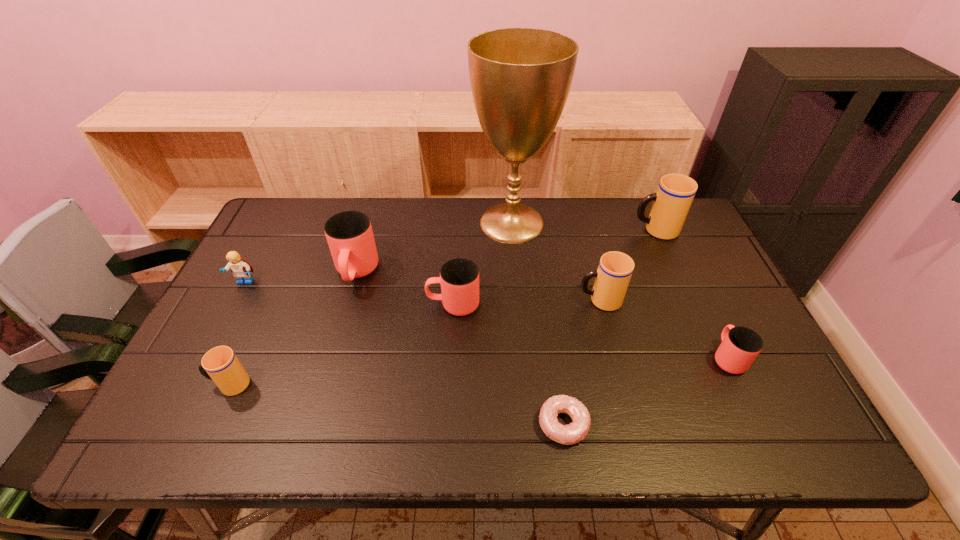
Identify the location of the leftmost cup. The height and width of the screenshot is (540, 960). (220, 364).

Identify the location of the nearest beige cup. (220, 364).

Where is `the smallest pink cup`? the smallest pink cup is located at coordinates (740, 346).

Locate an element on the screen. The width and height of the screenshot is (960, 540). the rightmost pink cup is located at coordinates point(740,346).

What are the coordinates of `the nearest object` in the screenshot? It's located at (576, 431).

Where is `pink doughnut`? Image resolution: width=960 pixels, height=540 pixels. pink doughnut is located at coordinates (576, 431).

The image size is (960, 540). In order to click on vacant area situated 0.240m on the left of the trophy cup in this screenshot , I will do `click(398, 223)`.

Image resolution: width=960 pixels, height=540 pixels. What are the coordinates of `free space located 0.400m on the side of the farthest cup with the handle` in the screenshot? It's located at (509, 230).

The image size is (960, 540). Find the location of `free space located 0.320m on the side of the farthest cup with the handle`. free space located 0.320m on the side of the farthest cup with the handle is located at coordinates 533,230.

At what (x,y) coordinates should I click in order to perform the action: click on free space located on the side of the farthest cup with the handle. Please return your answer as a coordinate pair (x, y). Looking at the image, I should click on (573, 230).